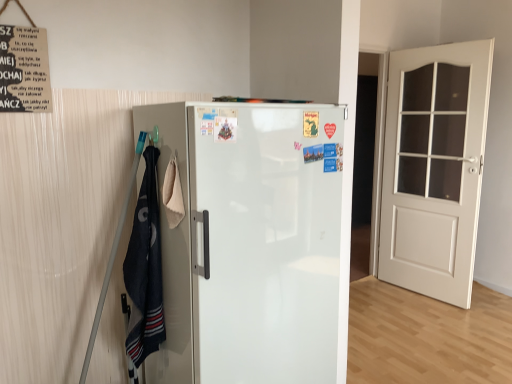
Question: Can you confirm if white glossy refrigerator at center is taller than white wood door at right?

Choices:
 (A) no
 (B) yes

Answer: (A)

Question: Does white glossy refrigerator at center come behind white wood door at right?

Choices:
 (A) no
 (B) yes

Answer: (A)

Question: Does white glossy refrigerator at center have a lesser width compared to white wood door at right?

Choices:
 (A) yes
 (B) no

Answer: (B)

Question: Considering the relative sizes of white glossy refrigerator at center and white wood door at right in the image provided, is white glossy refrigerator at center bigger than white wood door at right?

Choices:
 (A) yes
 (B) no

Answer: (A)

Question: Is white glossy refrigerator at center at the left side of white wood door at right?

Choices:
 (A) yes
 (B) no

Answer: (A)

Question: Is dark blue cotton towel at left taller or shorter than white glossy refrigerator at center?

Choices:
 (A) tall
 (B) short

Answer: (B)

Question: In the image, is dark blue cotton towel at left on the left side or the right side of white glossy refrigerator at center?

Choices:
 (A) right
 (B) left

Answer: (B)

Question: Is dark blue cotton towel at left inside the boundaries of white glossy refrigerator at center, or outside?

Choices:
 (A) inside
 (B) outside

Answer: (B)

Question: Based on their sizes in the image, would you say dark blue cotton towel at left is bigger or smaller than white glossy refrigerator at center?

Choices:
 (A) big
 (B) small

Answer: (B)

Question: Is point (148, 152) positioned closer to the camera than point (401, 218)?

Choices:
 (A) farther
 (B) closer

Answer: (B)

Question: From a real-world perspective, is dark blue cotton towel at left above or below white wood door at right?

Choices:
 (A) below
 (B) above

Answer: (A)

Question: In terms of height, does dark blue cotton towel at left look taller or shorter compared to white wood door at right?

Choices:
 (A) tall
 (B) short

Answer: (B)

Question: Considering the positions of dark blue cotton towel at left and white wood door at right in the image, is dark blue cotton towel at left bigger or smaller than white wood door at right?

Choices:
 (A) small
 (B) big

Answer: (A)

Question: Do you think white wood door at right is within white glossy refrigerator at center, or outside of it?

Choices:
 (A) inside
 (B) outside

Answer: (B)

Question: From a real-world perspective, is white wood door at right above or below white glossy refrigerator at center?

Choices:
 (A) above
 (B) below

Answer: (A)